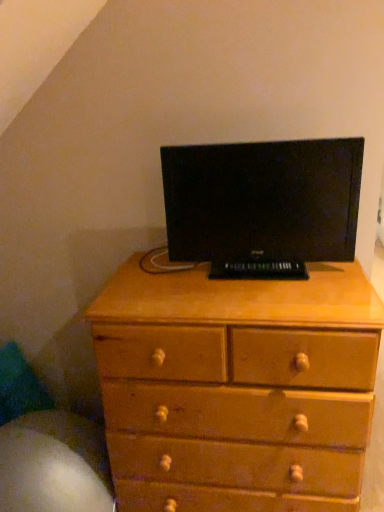
Describe the element at coordinates (262, 205) in the screenshot. I see `black matte computer monitor at center` at that location.

Where is `black matte computer monitor at center`? This screenshot has width=384, height=512. black matte computer monitor at center is located at coordinates (262, 205).

At what (x,y) coordinates should I click in order to perform the action: click on light brown wood chest of drawers at center. Please return your answer as a coordinate pair (x, y). Looking at the image, I should click on (237, 388).

This screenshot has width=384, height=512. What do you see at coordinates (237, 388) in the screenshot?
I see `light brown wood chest of drawers at center` at bounding box center [237, 388].

The height and width of the screenshot is (512, 384). Identify the location of black matte computer monitor at center. (262, 205).

Between black matte computer monitor at center and light brown wood chest of drawers at center, which one appears on the left side from the viewer's perspective?

From the viewer's perspective, light brown wood chest of drawers at center appears more on the left side.

Is black matte computer monitor at center in front of light brown wood chest of drawers at center?

No, it is behind light brown wood chest of drawers at center.

Considering the positions of point (307, 194) and point (303, 370), is point (307, 194) closer or farther from the camera than point (303, 370)?

Point (307, 194) is farther from the camera than point (303, 370).

From the image's perspective, would you say black matte computer monitor at center is shown under light brown wood chest of drawers at center?

No, from the image's perspective, black matte computer monitor at center is not beneath light brown wood chest of drawers at center.

From a real-world perspective, who is located lower, black matte computer monitor at center or light brown wood chest of drawers at center?

From a 3D spatial view, light brown wood chest of drawers at center is below.

In terms of width, does black matte computer monitor at center look wider or thinner when compared to light brown wood chest of drawers at center?

In the image, black matte computer monitor at center appears to be more narrow than light brown wood chest of drawers at center.

Considering the sizes of objects black matte computer monitor at center and light brown wood chest of drawers at center in the image provided, who is shorter, black matte computer monitor at center or light brown wood chest of drawers at center?

black matte computer monitor at center is shorter.

Between black matte computer monitor at center and light brown wood chest of drawers at center, which one has smaller size?

black matte computer monitor at center is smaller.

Would you say black matte computer monitor at center contains light brown wood chest of drawers at center?

No, black matte computer monitor at center does not contain light brown wood chest of drawers at center.

Would you say black matte computer monitor at center is a long distance from light brown wood chest of drawers at center?

black matte computer monitor at center is near light brown wood chest of drawers at center, not far away.

Is black matte computer monitor at center aimed at light brown wood chest of drawers at center?

No, black matte computer monitor at center is not oriented towards light brown wood chest of drawers at center.

Can you tell me how much black matte computer monitor at center and light brown wood chest of drawers at center differ in facing direction?

The angle between the facing direction of black matte computer monitor at center and the facing direction of light brown wood chest of drawers at center is 0.000946 degrees.

The height and width of the screenshot is (512, 384). Find the location of `chest of drawers lying on the left of black matte computer monitor at center`. chest of drawers lying on the left of black matte computer monitor at center is located at coordinates (237, 388).

From the picture: Considering the relative positions of light brown wood chest of drawers at center and black matte computer monitor at center in the image provided, is light brown wood chest of drawers at center to the right of black matte computer monitor at center from the viewer's perspective?

Incorrect, light brown wood chest of drawers at center is not on the right side of black matte computer monitor at center.

Does light brown wood chest of drawers at center come in front of black matte computer monitor at center?

Yes.

Is point (283, 492) less distant than point (164, 161)?

Yes.

From the image's perspective, is light brown wood chest of drawers at center located above or below black matte computer monitor at center?

light brown wood chest of drawers at center is below black matte computer monitor at center.

From a real-world perspective, relative to black matte computer monitor at center, is light brown wood chest of drawers at center vertically above or below?

light brown wood chest of drawers at center is situated lower than black matte computer monitor at center in the real world.

In terms of width, does light brown wood chest of drawers at center look wider or thinner when compared to black matte computer monitor at center?

Considering their sizes, light brown wood chest of drawers at center looks broader than black matte computer monitor at center.

From their relative heights in the image, would you say light brown wood chest of drawers at center is taller or shorter than black matte computer monitor at center?

light brown wood chest of drawers at center is taller than black matte computer monitor at center.

Based on their sizes in the image, would you say light brown wood chest of drawers at center is bigger or smaller than black matte computer monitor at center?

light brown wood chest of drawers at center is bigger than black matte computer monitor at center.

Is light brown wood chest of drawers at center surrounding black matte computer monitor at center?

No, black matte computer monitor at center is not a part of light brown wood chest of drawers at center.

Is light brown wood chest of drawers at center not near black matte computer monitor at center?

No, light brown wood chest of drawers at center is not far from black matte computer monitor at center.

Looking at this image, is light brown wood chest of drawers at center turned away from black matte computer monitor at center?

No, light brown wood chest of drawers at center's orientation is not away from black matte computer monitor at center.

You are a GUI agent. You are given a task and a screenshot of the screen. Output one action in this format:
    pyautogui.click(x=<x>, y=<y>)
    Task: Click on the chest of drawers beneath the black matte computer monitor at center (from a real-world perspective)
    Image resolution: width=384 pixels, height=512 pixels.
    Given the screenshot: What is the action you would take?
    pyautogui.click(x=237, y=388)

This screenshot has width=384, height=512. Identify the location of chest of drawers below the black matte computer monitor at center (from a real-world perspective). (237, 388).

Locate an element on the screen. This screenshot has height=512, width=384. the chest of drawers in front of the black matte computer monitor at center is located at coordinates (237, 388).